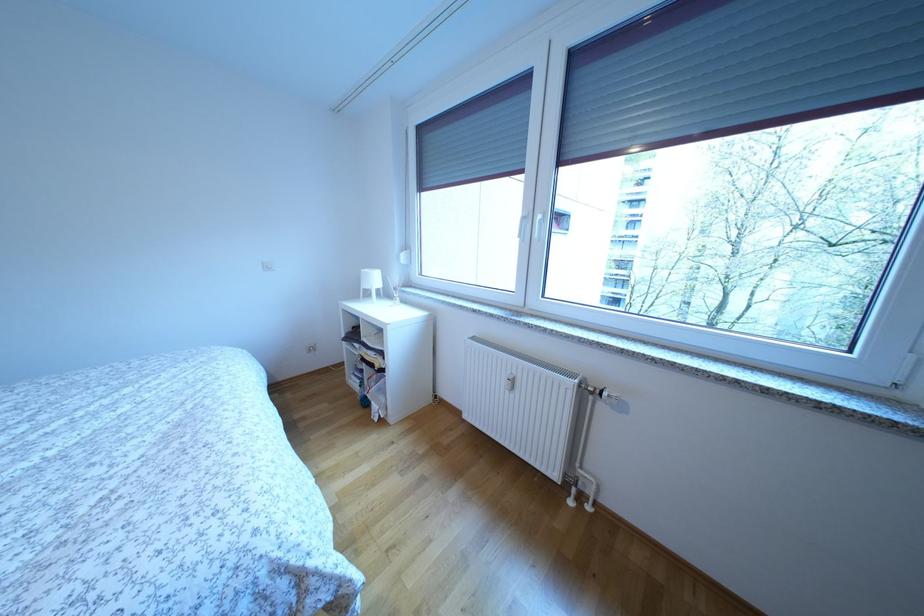
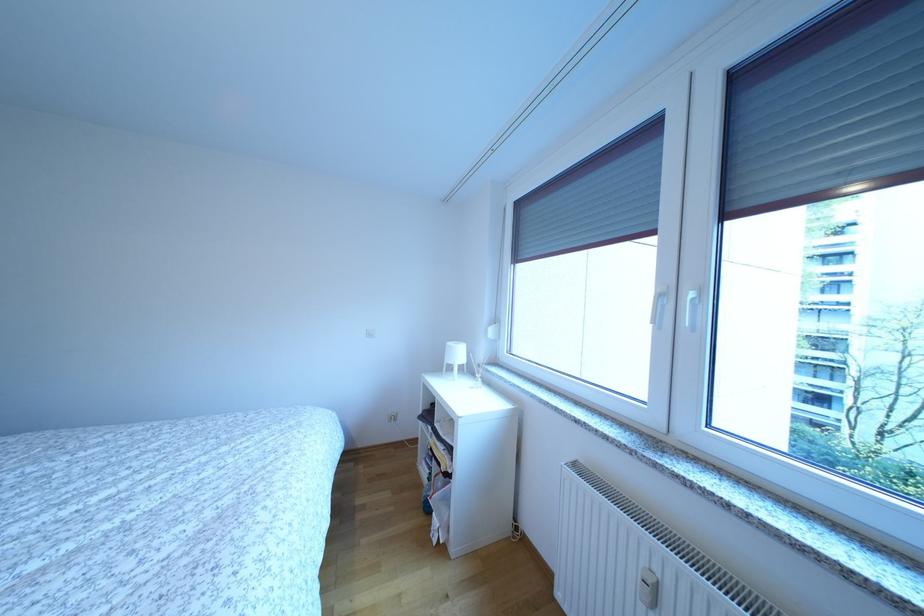
Question: In a continuous first-person perspective shot, in which direction is the camera moving?

Choices:
 (A) Left
 (B) Right
 (C) Forward
 (D) Backward

Answer: (C)